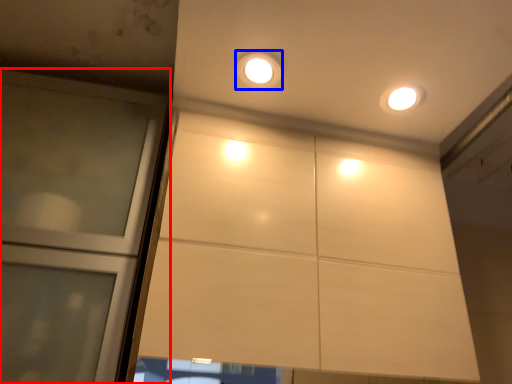
Question: Among these objects, which one is nearest to the camera, door (highlighted by a red box) or dot (highlighted by a blue box)?

Choices:
 (A) door
 (B) dot

Answer: (A)